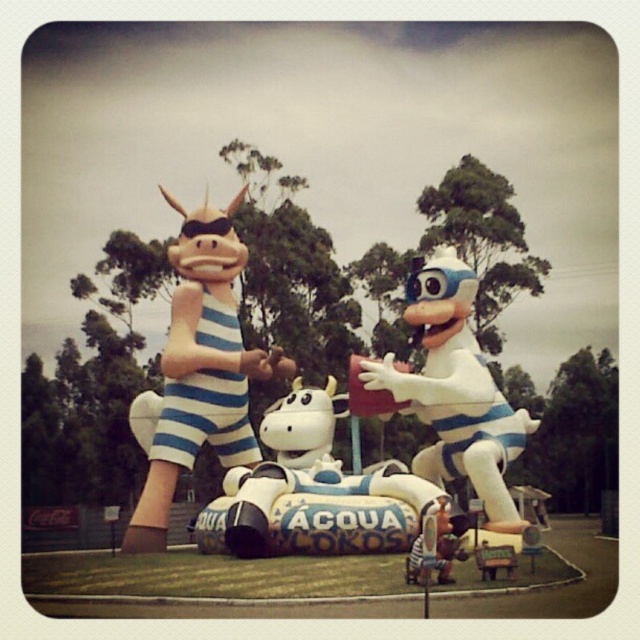
You are a child visiting the Acqua Panna promotional display. You see a white rubber car at center and a white glossy toy at center. Which object is directly above the other?

The white glossy toy at center is directly above the white rubber car at center because the white rubber car at center is positioned under it.

You are standing at the point labeled point (205, 241) in the image. You want to take a photo of the Acqua Panna promotional display from a distance of 100 meters. Can you move closer to the display to achieve this?

The point labeled point (205, 241) is 106.38 meters away from the camera. To take a photo from 100 meters away, you would need to move 6.38 meters closer to the display.